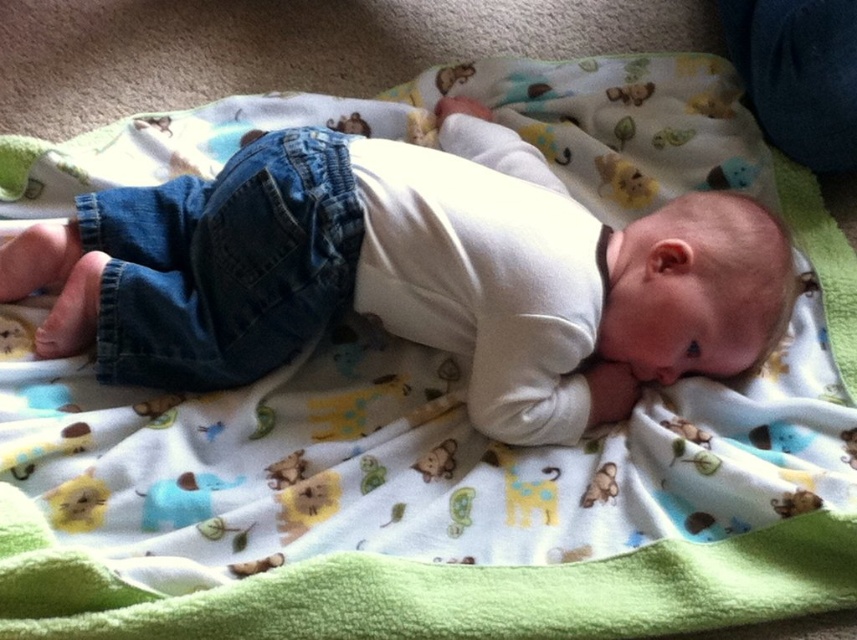
Question: Where is white soft baby at center located in relation to denim pants at left in the image?

Choices:
 (A) above
 (B) below

Answer: (A)

Question: Among these points, which one is nearest to the camera?

Choices:
 (A) pyautogui.click(x=340, y=134)
 (B) pyautogui.click(x=508, y=172)

Answer: (A)

Question: Can you confirm if white soft baby at center is positioned to the right of denim pants at left?

Choices:
 (A) yes
 (B) no

Answer: (A)

Question: Does white soft baby at center have a smaller size compared to denim pants at left?

Choices:
 (A) yes
 (B) no

Answer: (B)

Question: Which point is closer to the camera?

Choices:
 (A) coord(202,387)
 (B) coord(238,300)

Answer: (B)

Question: Which object is closer to the camera taking this photo?

Choices:
 (A) denim pants at left
 (B) white soft baby at center

Answer: (B)